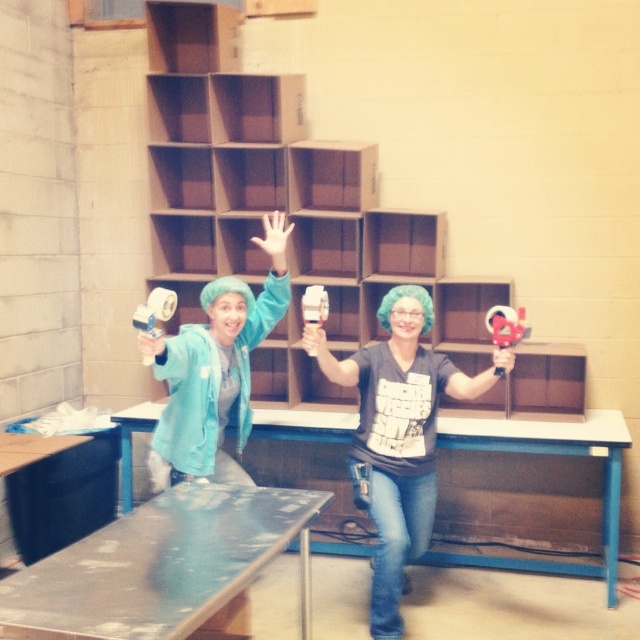
Question: Considering the real-world distances, which object is farthest from the blue metal table at center?

Choices:
 (A) metallic silver table at lower center
 (B) matte gray shirt at center

Answer: (A)

Question: Does metallic silver table at lower center appear on the left side of blue metal table at center?

Choices:
 (A) no
 (B) yes

Answer: (B)

Question: Does matte gray shirt at center have a larger size compared to blue metal table at center?

Choices:
 (A) yes
 (B) no

Answer: (A)

Question: Among these objects, which one is nearest to the camera?

Choices:
 (A) metallic silver table at lower center
 (B) blue metal table at center
 (C) matte gray shirt at center

Answer: (A)

Question: Considering the real-world distances, which object is farthest from the metallic silver table at lower center?

Choices:
 (A) blue metal table at center
 (B) matte gray shirt at center

Answer: (A)

Question: Can you confirm if matte gray shirt at center is positioned to the left of blue metal table at center?

Choices:
 (A) yes
 (B) no

Answer: (A)